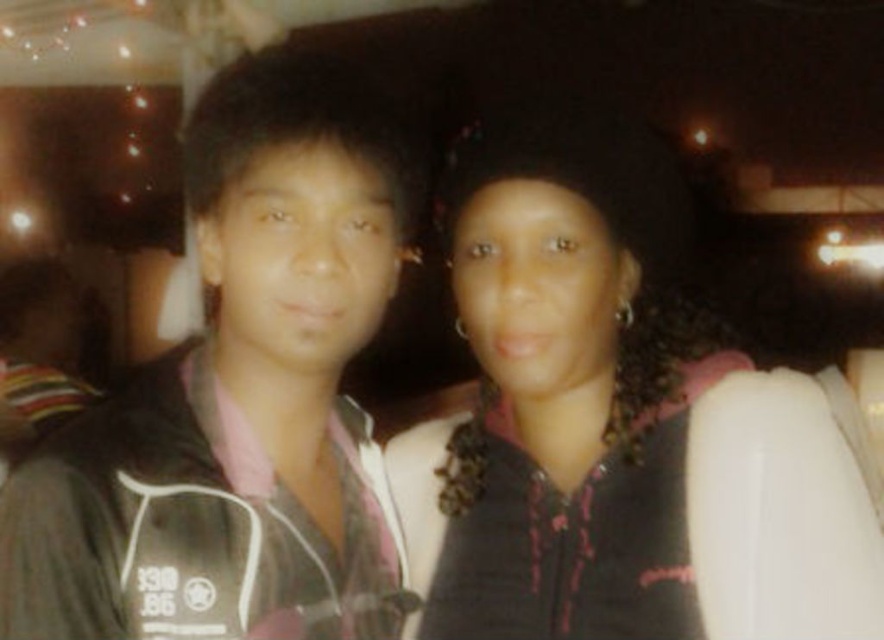
You are at a party and want to approach the black matte jacket at center and the black matte jacket at left. Which jacket is closer to the floor?

The black matte jacket at center is located below the black matte jacket at left, so it is closer to the floor.

You are at a party and want to approach the two people wearing black matte jackets. The one at the center and the one at the left. If you stand in front of the black matte jacket at left, which direction should you turn to face the black matte jacket at center?

The black matte jacket at center is to the right of the black matte jacket at left, so you should turn to your right to face the black matte jacket at center.

You are a fashion designer observing two black matte jackets in the image. The jackets are labeled as the black matte jacket at center and the black matte jacket at left. Which of these jackets is shorter in length?

The black matte jacket at center is shorter than the black matte jacket at left.